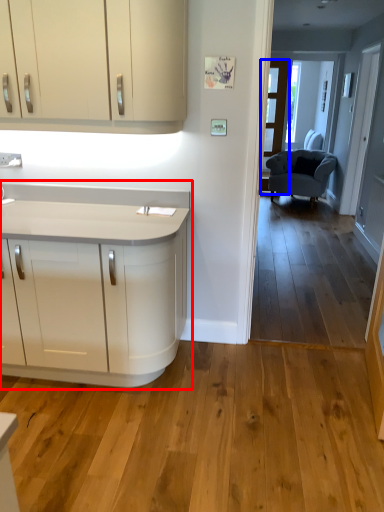
Question: Which object is closer to the camera taking this photo, countertop (highlighted by a red box) or glass door (highlighted by a blue box)?

Choices:
 (A) countertop
 (B) glass door

Answer: (A)